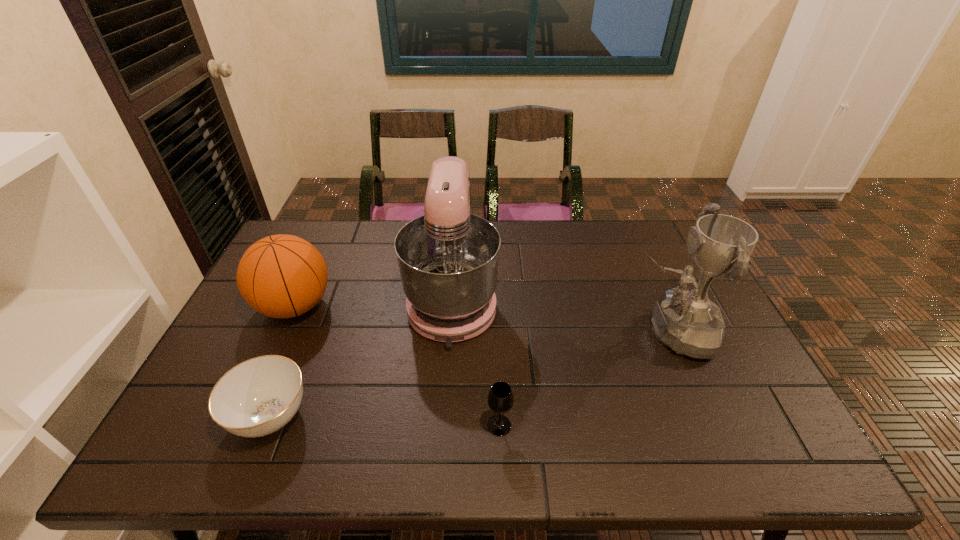
Image resolution: width=960 pixels, height=540 pixels. I want to click on free location at the near edge, so click(715, 433).

In the image, there is a desktop. At what (x,y) coordinates should I click in order to perform the action: click on vacant space at the right edge. Please return your answer as a coordinate pair (x, y). This screenshot has width=960, height=540. Looking at the image, I should click on (697, 376).

Locate an element on the screen. The image size is (960, 540). vacant space at the far left corner of the desktop is located at coordinates (328, 226).

Where is `vacant space at the far right corner`? The height and width of the screenshot is (540, 960). vacant space at the far right corner is located at coordinates (649, 234).

At what (x,y) coordinates should I click in order to perform the action: click on vacant area at the near right corner of the desktop. Please return your answer as a coordinate pair (x, y). The height and width of the screenshot is (540, 960). Looking at the image, I should click on (754, 451).

Locate an element on the screen. The height and width of the screenshot is (540, 960). empty location between the mixer and the shortest object is located at coordinates (362, 359).

Locate an element on the screen. free point between the basketball and the mixer is located at coordinates (373, 303).

Image resolution: width=960 pixels, height=540 pixels. Find the location of `vacant area that lies between the mixer and the rightmost object`. vacant area that lies between the mixer and the rightmost object is located at coordinates (562, 316).

This screenshot has height=540, width=960. I want to click on free point between the wineglass and the mixer, so [x=476, y=363].

Locate an element on the screen. blank region between the mixer and the wineglass is located at coordinates (476, 363).